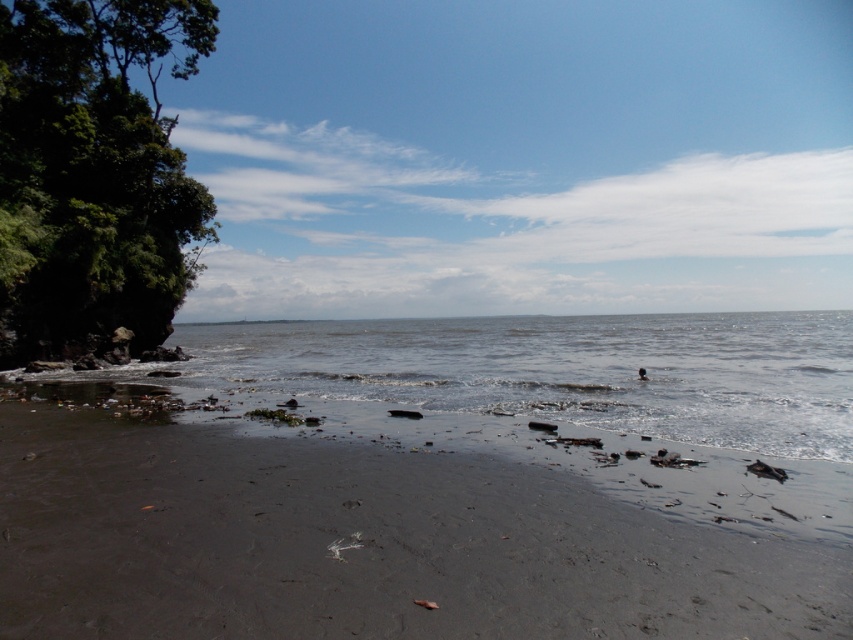
You are standing on the dark gray sand at lower center and want to walk towards the green leafy tree at left. Which direction should you face to head directly towards the tree?

You should face towards the left direction to head directly towards the green leafy tree at left from the dark gray sand at lower center.